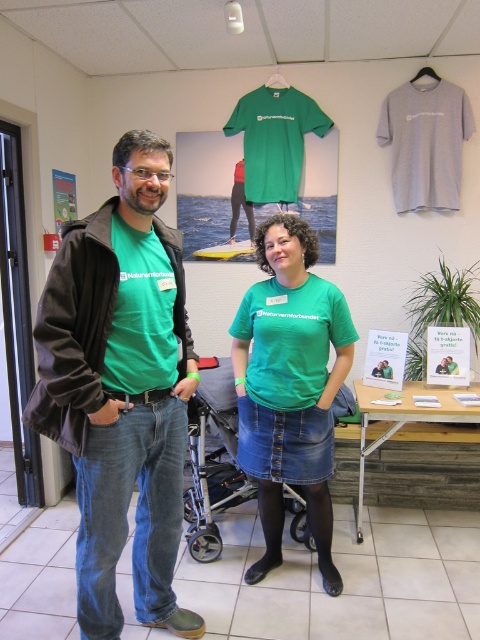
You are a photographer who needs to capture a clear photo of both the green fabric shirt at center and the metallic gray baby carriage at center. The minimum focusing distance for your camera is 40 centimeters. Can you take the photo without moving either object?

The green fabric shirt at center is 40.70 centimeters away from the metallic gray baby carriage at center. Since the minimum focusing distance is 40 centimeters, the distance between them is sufficient, so yes, you can take the photo without moving either object.

You are a photographer trying to focus on the green fabric shirt at center in the image. The camera has a focus point at coordinate point (289,385). Will this point help you focus on the green fabric shirt at center?

Yes, the point (289,385) corresponds to the green fabric shirt at center, so using this focus point will help you focus on the green fabric shirt at center.